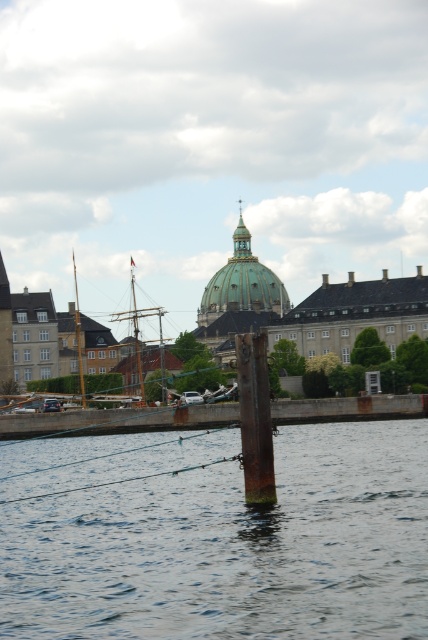
Question: Does rusty metal dock at center have a smaller size compared to rusty metal pole at center?

Choices:
 (A) yes
 (B) no

Answer: (B)

Question: Which of these objects is positioned closest to the rusty metal dock at center?

Choices:
 (A) rusty metal post at lower center
 (B) rusty metal pole at center

Answer: (A)

Question: Is the position of rusty metal post at lower center more distant than that of rusty metal dock at center?

Choices:
 (A) yes
 (B) no

Answer: (B)

Question: Estimate the real-world distances between objects in this image. Which object is closer to the rusty metal dock at center?

Choices:
 (A) green marble dome at center
 (B) rusty metal post at lower center

Answer: (B)

Question: Is rusty metal post at lower center above green marble dome at center?

Choices:
 (A) yes
 (B) no

Answer: (B)

Question: Considering the real-world distances, which object is farthest from the green marble dome at center?

Choices:
 (A) rusty metal pole at center
 (B) rusty metal dock at center
 (C) rusty metal post at lower center

Answer: (A)